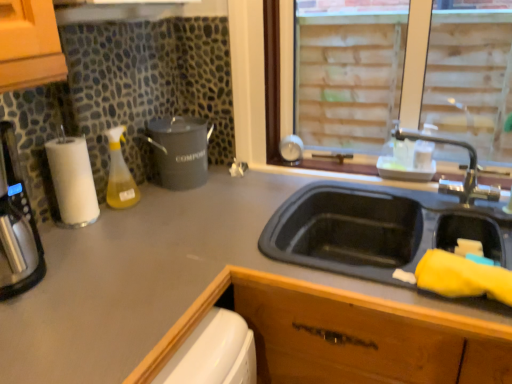
This screenshot has height=384, width=512. I want to click on free location in front of translucent yellow liquid at bottle left, so click(x=117, y=218).